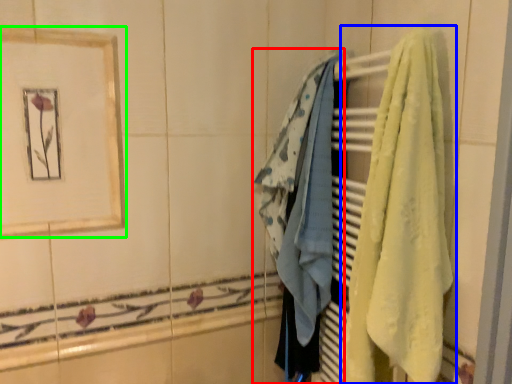
Question: Estimate the real-world distances between objects in this image. Which object is closer to towel (highlighted by a red box), towel (highlighted by a blue box) or picture frame (highlighted by a green box)?

Choices:
 (A) towel
 (B) picture frame

Answer: (A)